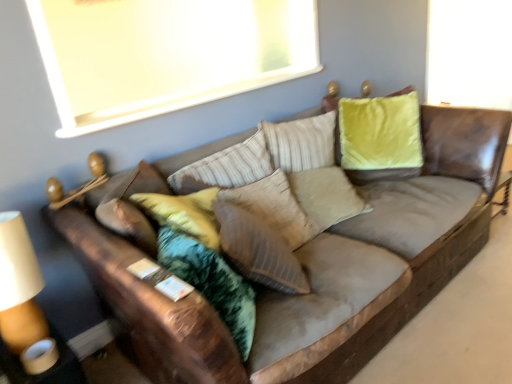
What do you see at coordinates (166, 54) in the screenshot?
I see `white matte window screen at upper center` at bounding box center [166, 54].

The height and width of the screenshot is (384, 512). Identify the location of suede textured pillow at center. (258, 249).

From a real-world perspective, which is physically below, white matte window screen at upper center or brown leather couch at center?

In real-world perspective, brown leather couch at center is lower.

I want to click on window screen located above the brown leather couch at center (from a real-world perspective), so click(166, 54).

Looking at the image, does white matte window screen at upper center seem bigger or smaller compared to brown leather couch at center?

Considering their sizes, white matte window screen at upper center takes up less space than brown leather couch at center.

In the scene shown: Which object is closer to the camera, white matte window screen at upper center or brown leather couch at center?

brown leather couch at center is more forward.

Identify the location of pillow that appears below the brown leather couch at center (from the image's perspective). (x=258, y=249).

From a real-world perspective, is suede textured pillow at center under brown leather couch at center?

Incorrect, from a real-world perspective, suede textured pillow at center is higher than brown leather couch at center.

Is suede textured pillow at center situated inside brown leather couch at center or outside?

suede textured pillow at center fits inside brown leather couch at center.

Is suede textured pillow at center far away from brown leather couch at center?

No, suede textured pillow at center is in close proximity to brown leather couch at center.

Is brown leather couch at center far from white matte window screen at upper center?

Absolutely, brown leather couch at center is distant from white matte window screen at upper center.

Which object is positioned more to the right, brown leather couch at center or white matte window screen at upper center?

brown leather couch at center.

Is brown leather couch at center facing away from white matte window screen at upper center?

No, brown leather couch at center is not facing the opposite direction of white matte window screen at upper center.

In the scene shown: From a real-world perspective, is brown leather couch at center beneath white matte window screen at upper center?

Indeed, from a real-world perspective, brown leather couch at center is positioned beneath white matte window screen at upper center.

Is suede textured pillow at center bigger than white matte window screen at upper center?

No, suede textured pillow at center is not bigger than white matte window screen at upper center.

Is suede textured pillow at center placed right next to white matte window screen at upper center?

No, suede textured pillow at center is not with white matte window screen at upper center.

From a real-world perspective, between suede textured pillow at center and white matte window screen at upper center, who is vertically lower?

suede textured pillow at center.

Can you confirm if brown leather couch at center is smaller than suede textured pillow at center?

Actually, brown leather couch at center might be larger than suede textured pillow at center.

Is brown leather couch at center shorter than suede textured pillow at center?

In fact, brown leather couch at center may be taller than suede textured pillow at center.

From a real-world perspective, is brown leather couch at center beneath suede textured pillow at center?

Yes, from a real-world perspective, brown leather couch at center is below suede textured pillow at center.

Is white matte window screen at upper center spatially inside suede textured pillow at center, or outside of it?

white matte window screen at upper center is spatially situated outside suede textured pillow at center.

At what (x,y) coordinates should I click in order to perform the action: click on window screen above the suede textured pillow at center (from the image's perspective). Please return your answer as a coordinate pair (x, y). Looking at the image, I should click on (166, 54).

Relative to suede textured pillow at center, is white matte window screen at upper center in front or behind?

In the image, white matte window screen at upper center appears behind suede textured pillow at center.

Between white matte window screen at upper center and suede textured pillow at center, which one has less height?

With less height is suede textured pillow at center.

This screenshot has width=512, height=384. In order to click on window screen above the brown leather couch at center (from a real-world perspective) in this screenshot , I will do `click(166, 54)`.

In order to click on studio couch that is above the suede textured pillow at center (from the image's perspective) in this screenshot , I will do `click(392, 254)`.

From the image, which object appears to be farther from brown leather couch at center, suede textured pillow at center or white matte window screen at upper center?

white matte window screen at upper center.

Estimate the real-world distances between objects in this image. Which object is further from suede textured pillow at center, brown leather couch at center or white matte window screen at upper center?

white matte window screen at upper center is positioned further to the anchor suede textured pillow at center.

Based on their spatial positions, is brown leather couch at center or suede textured pillow at center closer to white matte window screen at upper center?

Based on the image, brown leather couch at center appears to be nearer to white matte window screen at upper center.

Looking at the image, which one is located closer to brown leather couch at center, white matte window screen at upper center or suede textured pillow at center?

A: The object closer to brown leather couch at center is suede textured pillow at center.

Considering their positions, is suede textured pillow at center positioned further to white matte window screen at upper center than brown leather couch at center?

suede textured pillow at center lies further to white matte window screen at upper center than the other object.

From the image, which object appears to be nearer to suede textured pillow at center, white matte window screen at upper center or brown leather couch at center?

brown leather couch at center is positioned closer to the anchor suede textured pillow at center.

You are a GUI agent. You are given a task and a screenshot of the screen. Output one action in this format:
    pyautogui.click(x=<x>, y=<y>)
    Task: Click on the studio couch between white matte window screen at upper center and suede textured pillow at center in the vertical direction
    The height and width of the screenshot is (384, 512).
    Given the screenshot: What is the action you would take?
    pyautogui.click(x=392, y=254)